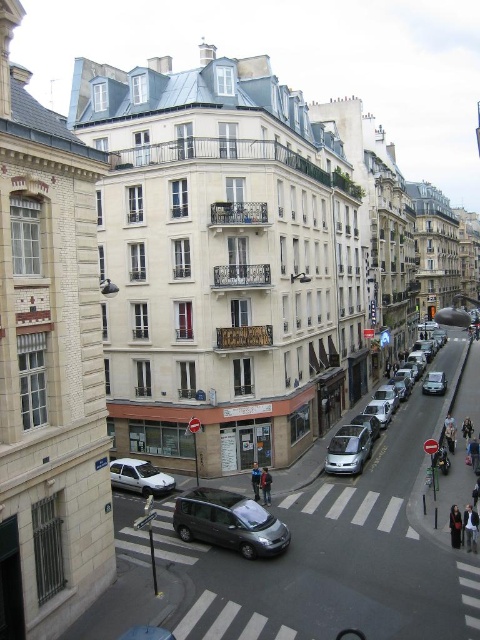
Question: Can you confirm if metallic gray minivan at center is positioned below dark gray fabric jacket at center?

Choices:
 (A) yes
 (B) no

Answer: (B)

Question: Which of the following is the farthest from the observer?

Choices:
 (A) (256, 518)
 (B) (332, 436)
 (C) (167, 512)
 (D) (452, 518)

Answer: (B)

Question: Is silver metallic car at center to the right of dark gray coat at lower right from the viewer's perspective?

Choices:
 (A) yes
 (B) no

Answer: (A)

Question: Estimate the real-world distances between objects in this image. Which object is closer to the metallic silver van at center?

Choices:
 (A) silver metallic car at center-right
 (B) dark gray fabric jacket at center
 (C) dark blue jacket at center
 (D) dark gray coat at lower right

Answer: (D)

Question: Does silver metallic car at center have a lesser width compared to light brown leather jacket at lower right?

Choices:
 (A) yes
 (B) no

Answer: (B)

Question: Which of these objects is positioned farthest from the dark blue jacket at center?

Choices:
 (A) light brown leather jacket at lower right
 (B) silver metallic car at center
 (C) dark gray coat at lower right
 (D) metallic gray minivan at center

Answer: (B)